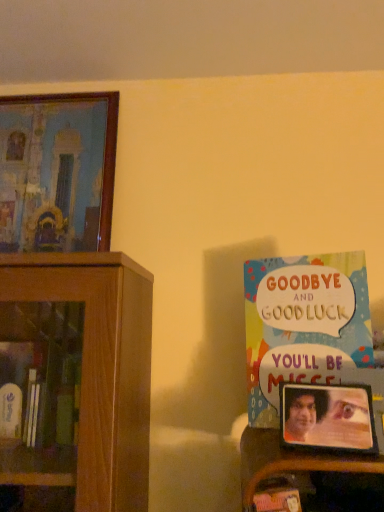
Describe the element at coordinates (303, 324) in the screenshot. I see `multicolored paper book at right` at that location.

Find the location of `multicolored paper book at right`. multicolored paper book at right is located at coordinates (303, 324).

Image resolution: width=384 pixels, height=512 pixels. What do you see at coordinates (328, 417) in the screenshot? I see `metallic silver photo frame at right, the first picture frame positioned from the front` at bounding box center [328, 417].

What are the coordinates of `metallic silver photo frame at right, the first picture frame positioned from the front` in the screenshot? It's located at (328, 417).

The height and width of the screenshot is (512, 384). I want to click on wooden framed painting at upper left, acting as the 2th picture frame starting from the front, so [x=57, y=170].

Are wooden framed painting at upper left, placed as the first picture frame when sorted from top to bottom, and multicolored paper book at right making contact?

No, wooden framed painting at upper left, placed as the first picture frame when sorted from top to bottom, is not with multicolored paper book at right.

Looking at this image, can you confirm if wooden framed painting at upper left, marked as the 1th picture frame in a left-to-right arrangement, is shorter than multicolored paper book at right?

In fact, wooden framed painting at upper left, marked as the 1th picture frame in a left-to-right arrangement, may be taller than multicolored paper book at right.

Locate an element on the screen. book that is in front of the wooden framed painting at upper left, the first picture frame when ordered from back to front is located at coordinates (303, 324).

Who is smaller, wooden framed painting at upper left, marked as the 1th picture frame in a left-to-right arrangement, or multicolored paper book at right?

multicolored paper book at right is smaller.

The image size is (384, 512). Find the location of `picture frame on the right of multicolored paper book at right`. picture frame on the right of multicolored paper book at right is located at coordinates (328, 417).

Considering the sizes of objects multicolored paper book at right and metallic silver photo frame at right, positioned as the 1th picture frame in right-to-left order, in the image provided, who is wider, multicolored paper book at right or metallic silver photo frame at right, positioned as the 1th picture frame in right-to-left order,?

metallic silver photo frame at right, positioned as the 1th picture frame in right-to-left order.

Would you say multicolored paper book at right is to the left or to the right of metallic silver photo frame at right, positioned as the 1th picture frame in right-to-left order, in the picture?

Clearly, multicolored paper book at right is on the left of metallic silver photo frame at right, positioned as the 1th picture frame in right-to-left order, in the image.

From a real-world perspective, between multicolored paper book at right and metallic silver photo frame at right, positioned as the 1th picture frame in right-to-left order, who is vertically higher?

multicolored paper book at right.

Can you confirm if metallic silver photo frame at right, the first picture frame positioned from the front, is wider than wooden framed painting at upper left, which appears as the second picture frame when ordered from the bottom?

In fact, metallic silver photo frame at right, the first picture frame positioned from the front, might be narrower than wooden framed painting at upper left, which appears as the second picture frame when ordered from the bottom.

Could wooden framed painting at upper left, which appears as the second picture frame when ordered from the bottom, be considered to be inside metallic silver photo frame at right, the second picture frame from the top?

Definitely not — wooden framed painting at upper left, which appears as the second picture frame when ordered from the bottom, is not inside metallic silver photo frame at right, the second picture frame from the top.

Is metallic silver photo frame at right, the first picture frame from the bottom, oriented away from wooden framed painting at upper left, marked as the second picture frame in a right-to-left arrangement?

metallic silver photo frame at right, the first picture frame from the bottom, is not turned away from wooden framed painting at upper left, marked as the second picture frame in a right-to-left arrangement.

Where is `picture frame located on the left of metallic silver photo frame at right, positioned as the 1th picture frame in right-to-left order`? This screenshot has height=512, width=384. picture frame located on the left of metallic silver photo frame at right, positioned as the 1th picture frame in right-to-left order is located at coordinates (57, 170).

Which of these two, wooden framed painting at upper left, acting as the 2th picture frame starting from the front, or metallic silver photo frame at right, the second picture frame in the back-to-front sequence, is wider?

wooden framed painting at upper left, acting as the 2th picture frame starting from the front.

Considering the sizes of objects wooden framed painting at upper left, marked as the second picture frame in a right-to-left arrangement, and metallic silver photo frame at right, the first picture frame positioned from the front, in the image provided, who is smaller, wooden framed painting at upper left, marked as the second picture frame in a right-to-left arrangement, or metallic silver photo frame at right, the first picture frame positioned from the front,?

metallic silver photo frame at right, the first picture frame positioned from the front, is smaller.

Relative to metallic silver photo frame at right, the first picture frame positioned from the front, is wooden framed painting at upper left, the first picture frame when ordered from back to front, in front or behind?

wooden framed painting at upper left, the first picture frame when ordered from back to front, is behind metallic silver photo frame at right, the first picture frame positioned from the front.

From their relative heights in the image, would you say wooden framed painting at upper left, placed as the first picture frame when sorted from top to bottom, is taller or shorter than metallic silver photo frame at right, positioned as the 1th picture frame in right-to-left order?

Considering their sizes, wooden framed painting at upper left, placed as the first picture frame when sorted from top to bottom, has more height than metallic silver photo frame at right, positioned as the 1th picture frame in right-to-left order.

Which is in front, point (378, 446) or point (360, 326)?

The point (378, 446) is more forward.

Could you tell me if metallic silver photo frame at right, the first picture frame from the bottom, is turned towards multicolored paper book at right?

No, metallic silver photo frame at right, the first picture frame from the bottom, is not aimed at multicolored paper book at right.

In the scene shown: Who is bigger, metallic silver photo frame at right, the first picture frame positioned from the front, or multicolored paper book at right?

multicolored paper book at right is bigger.

How many degrees apart are the facing directions of metallic silver photo frame at right, the first picture frame from the bottom, and multicolored paper book at right?

There is a 14-degree angle between the facing directions of metallic silver photo frame at right, the first picture frame from the bottom, and multicolored paper book at right.

Looking at this image, is multicolored paper book at right situated inside wooden framed painting at upper left, which appears as the second picture frame when ordered from the bottom, or outside?

The correct answer is: outside.

Does point (330, 268) come closer to viewer compared to point (113, 105)?

Yes.

What's the angular difference between multicolored paper book at right and wooden framed painting at upper left, acting as the 2th picture frame starting from the front,'s facing directions?

There is a 24.2-degree angle between the facing directions of multicolored paper book at right and wooden framed painting at upper left, acting as the 2th picture frame starting from the front.

Is multicolored paper book at right next to wooden framed painting at upper left, marked as the second picture frame in a right-to-left arrangement, and touching it?

multicolored paper book at right is not next to wooden framed painting at upper left, marked as the second picture frame in a right-to-left arrangement, and they're not touching.

Locate an element on the screen. book located underneath the wooden framed painting at upper left, which appears as the second picture frame when ordered from the bottom (from a real-world perspective) is located at coordinates (303, 324).

The height and width of the screenshot is (512, 384). Identify the location of book above the metallic silver photo frame at right, the first picture frame from the bottom (from a real-world perspective). (303, 324).

Looking at the image, which one is located closer to multicolored paper book at right, metallic silver photo frame at right, the second picture frame from the top, or wooden framed painting at upper left, which appears as the second picture frame when ordered from the bottom?

The object closer to multicolored paper book at right is metallic silver photo frame at right, the second picture frame from the top.

Looking at the image, which one is located closer to metallic silver photo frame at right, positioned as the 1th picture frame in right-to-left order, wooden framed painting at upper left, the first picture frame when ordered from back to front, or multicolored paper book at right?

Based on the image, multicolored paper book at right appears to be nearer to metallic silver photo frame at right, positioned as the 1th picture frame in right-to-left order.

Looking at the image, which one is located further to wooden framed painting at upper left, acting as the 2th picture frame starting from the front, multicolored paper book at right or metallic silver photo frame at right, the second picture frame from the top?

metallic silver photo frame at right, the second picture frame from the top, lies further to wooden framed painting at upper left, acting as the 2th picture frame starting from the front, than the other object.

From the image, which object appears to be nearer to metallic silver photo frame at right, the first picture frame positioned from the front, multicolored paper book at right or wooden framed painting at upper left, the first picture frame when ordered from back to front?

multicolored paper book at right is closer to metallic silver photo frame at right, the first picture frame positioned from the front.

Estimate the real-world distances between objects in this image. Which object is further from multicolored paper book at right, wooden framed painting at upper left, marked as the second picture frame in a right-to-left arrangement, or metallic silver photo frame at right, the second picture frame in the back-to-front sequence?

wooden framed painting at upper left, marked as the second picture frame in a right-to-left arrangement, lies further to multicolored paper book at right than the other object.

From the image, which object appears to be farther from wooden framed painting at upper left, marked as the 1th picture frame in a left-to-right arrangement, metallic silver photo frame at right, the second picture frame in the back-to-front sequence, or multicolored paper book at right?

Based on the image, metallic silver photo frame at right, the second picture frame in the back-to-front sequence, appears to be further to wooden framed painting at upper left, marked as the 1th picture frame in a left-to-right arrangement.

Image resolution: width=384 pixels, height=512 pixels. I want to click on book between wooden framed painting at upper left, marked as the 1th picture frame in a left-to-right arrangement, and metallic silver photo frame at right, the second picture frame from the top, in the horizontal direction, so click(303, 324).